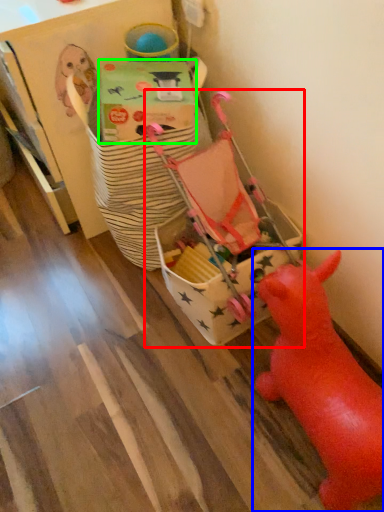
Question: Which object is the closest to the toy (highlighted by a red box)? Choose among these: toy (highlighted by a blue box) or cardboard box (highlighted by a green box).

Choices:
 (A) toy
 (B) cardboard box

Answer: (B)